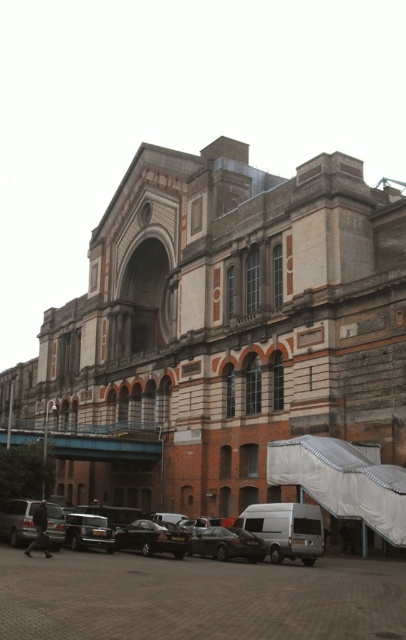
Question: Does silver metallic van at lower center have a smaller size compared to shiny black car at center?

Choices:
 (A) yes
 (B) no

Answer: (B)

Question: Is black asphalt parking lot at lower center smaller than silver metallic car at lower left?

Choices:
 (A) yes
 (B) no

Answer: (B)

Question: Which of these objects is positioned closest to the white textured canopy at lower right?

Choices:
 (A) shiny black car at center
 (B) silver metallic car at lower left
 (C) shiny black sedan at center
 (D) black asphalt parking lot at lower center

Answer: (A)

Question: Which point is farther from the camera taking this photo?

Choices:
 (A) (310, 490)
 (B) (287, 621)

Answer: (A)

Question: Observing the image, what is the correct spatial positioning of black asphalt parking lot at lower center in reference to silver metallic car at lower left?

Choices:
 (A) below
 (B) above

Answer: (B)

Question: Estimate the real-world distances between objects in this image. Which object is farther from the silver metallic car at lower left?

Choices:
 (A) shiny black car at center
 (B) white textured canopy at lower right
 (C) silver metallic van at lower center

Answer: (B)